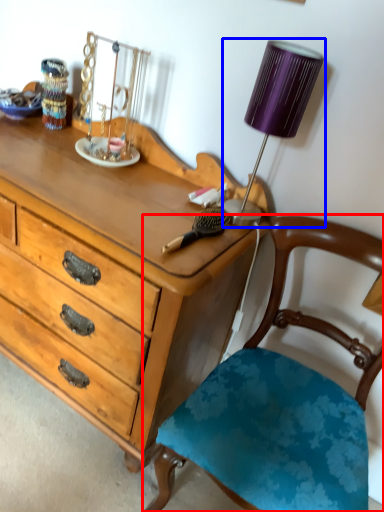
Question: Which object is further to the camera taking this photo, chair (highlighted by a red box) or lamp (highlighted by a blue box)?

Choices:
 (A) chair
 (B) lamp

Answer: (B)